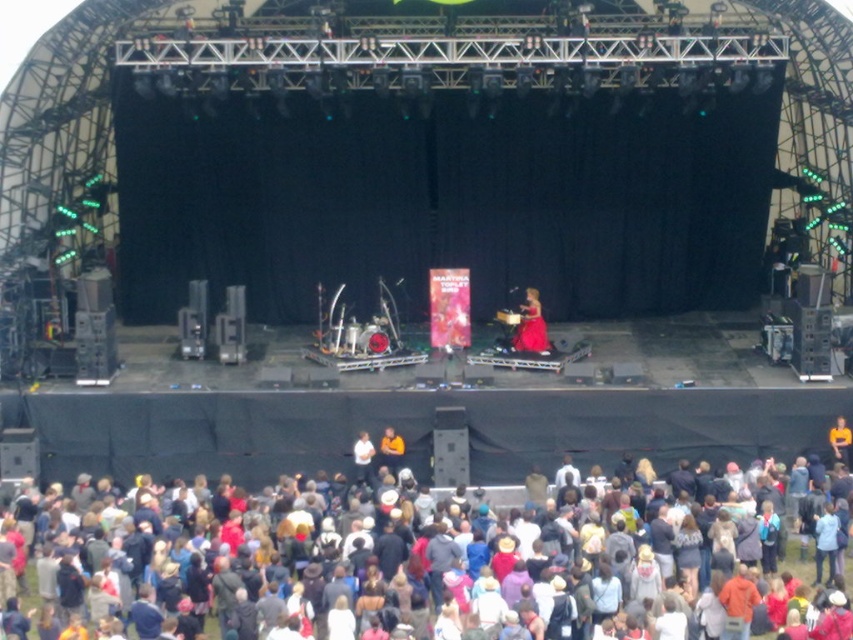
Question: Is multicolored fabric crowd at lower center above matte pink dress at center?

Choices:
 (A) yes
 (B) no

Answer: (B)

Question: Is multicolored fabric crowd at lower center closer to camera compared to matte pink dress at center?

Choices:
 (A) yes
 (B) no

Answer: (A)

Question: Can you confirm if multicolored fabric crowd at lower center is positioned to the right of matte pink dress at center?

Choices:
 (A) yes
 (B) no

Answer: (B)

Question: Which of the following is the farthest from the observer?

Choices:
 (A) matte pink dress at center
 (B) multicolored fabric crowd at lower center

Answer: (A)

Question: Which object appears farthest from the camera in this image?

Choices:
 (A) multicolored fabric crowd at lower center
 (B) matte pink dress at center

Answer: (B)

Question: Which point appears closest to the camera in this image?

Choices:
 (A) (532, 333)
 (B) (59, 577)

Answer: (B)